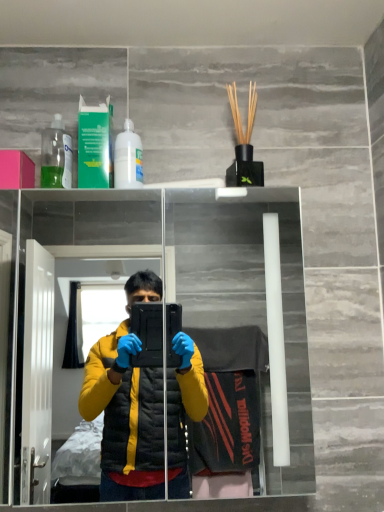
This screenshot has width=384, height=512. Describe the element at coordinates (95, 145) in the screenshot. I see `green plastic mouthwash at upper left` at that location.

Image resolution: width=384 pixels, height=512 pixels. Describe the element at coordinates (202, 98) in the screenshot. I see `transparent glass mirror at upper center` at that location.

The width and height of the screenshot is (384, 512). Identify the location of transparent plastic bottle at upper left, the second bottle viewed from the right. (56, 156).

Would you say pink matte box at upper left is part of transparent glass mirror at upper center's contents?

No, pink matte box at upper left is not inside transparent glass mirror at upper center.

From the image's perspective, is transparent glass mirror at upper center on pink matte box at upper left?

No.

Locate an element on the screen. This screenshot has height=512, width=384. mirror that is under the pink matte box at upper left (from a real-world perspective) is located at coordinates (202, 98).

Measure the distance between transparent glass mirror at upper center and pink matte box at upper left.

A distance of 5.73 feet exists between transparent glass mirror at upper center and pink matte box at upper left.

Does transparent plastic bottle at upper left, placed as the first bottle when sorted from left to right, have a lesser height compared to transparent glass mirror at upper center?

Correct, transparent plastic bottle at upper left, placed as the first bottle when sorted from left to right, is not as tall as transparent glass mirror at upper center.

Is transparent plastic bottle at upper left, the second bottle viewed from the right, with transparent glass mirror at upper center?

They are not placed beside each other.

Is transparent plastic bottle at upper left, placed as the first bottle when sorted from left to right, oriented towards transparent glass mirror at upper center?

No.

Which of these two, transparent plastic bottle at upper left, placed as the first bottle when sorted from left to right, or transparent glass mirror at upper center, is bigger?

With larger size is transparent glass mirror at upper center.

Considering the sizes of objects white glossy bottle at upper center, the second bottle positioned from the left, and green plastic mouthwash at upper left in the image provided, who is thinner, white glossy bottle at upper center, the second bottle positioned from the left, or green plastic mouthwash at upper left?

With smaller width is green plastic mouthwash at upper left.

From a real-world perspective, which is physically below, white glossy bottle at upper center, the second bottle positioned from the left, or green plastic mouthwash at upper left?

white glossy bottle at upper center, the second bottle positioned from the left, from a real-world perspective.

Is green plastic mouthwash at upper left at the back of white glossy bottle at upper center, the second bottle positioned from the left?

white glossy bottle at upper center, the second bottle positioned from the left, does not have its back to green plastic mouthwash at upper left.

From the image's perspective, who appears lower, transparent glass mirror at upper center or green plastic mouthwash at upper left?

transparent glass mirror at upper center.

Is transparent glass mirror at upper center not close to green plastic mouthwash at upper left?

Indeed, transparent glass mirror at upper center is not near green plastic mouthwash at upper left.

The image size is (384, 512). What are the coordinates of `mouthwash above the transparent glass mirror at upper center (from a real-world perspective)` in the screenshot? It's located at (95, 145).

In the scene shown: From a real-world perspective, is transparent glass mirror at upper center physically located above or below green plastic mouthwash at upper left?

Answer: transparent glass mirror at upper center is situated lower than green plastic mouthwash at upper left in the real world.

From a real-world perspective, who is located lower, transparent glass mirror at upper center or transparent plastic bottle at upper left, the second bottle viewed from the right?

transparent glass mirror at upper center, from a real-world perspective.

Which point is more distant from viewer, (290, 487) or (57, 178)?

The point (290, 487) is farther from the camera.

Does transparent glass mirror at upper center have a lesser width compared to transparent plastic bottle at upper left, placed as the first bottle when sorted from left to right?

Incorrect, the width of transparent glass mirror at upper center is not less than that of transparent plastic bottle at upper left, placed as the first bottle when sorted from left to right.

Is transparent glass mirror at upper center further to the viewer compared to transparent plastic bottle at upper left, the second bottle viewed from the right?

No, the depth of transparent glass mirror at upper center is less than that of transparent plastic bottle at upper left, the second bottle viewed from the right.

Consider the image. Is white glossy bottle at upper center, the second bottle positioned from the left, not inside transparent plastic bottle at upper left, the second bottle viewed from the right?

Absolutely, white glossy bottle at upper center, the second bottle positioned from the left, is external to transparent plastic bottle at upper left, the second bottle viewed from the right.

From a real-world perspective, is white glossy bottle at upper center, the first bottle viewed from the right, physically located above or below transparent plastic bottle at upper left, the second bottle viewed from the right?

From a real-world perspective, white glossy bottle at upper center, the first bottle viewed from the right, is physically below transparent plastic bottle at upper left, the second bottle viewed from the right.

From the image's perspective, which one is positioned higher, white glossy bottle at upper center, the second bottle positioned from the left, or transparent plastic bottle at upper left, the second bottle viewed from the right?

transparent plastic bottle at upper left, the second bottle viewed from the right, appears higher in the image.

Is point (139, 170) closer or farther from the camera than point (71, 178)?

Point (139, 170) appears to be closer to the viewer than point (71, 178).

Is white glossy bottle at upper center, the first bottle viewed from the right, taller than transparent glass mirror at upper center?

In fact, white glossy bottle at upper center, the first bottle viewed from the right, may be shorter than transparent glass mirror at upper center.

From the image's perspective, would you say white glossy bottle at upper center, the first bottle viewed from the right, is positioned over transparent glass mirror at upper center?

Correct, white glossy bottle at upper center, the first bottle viewed from the right, appears higher than transparent glass mirror at upper center in the image.

Does point (139, 163) come behind point (183, 294)?

No, (139, 163) is in front of (183, 294).

Is white glossy bottle at upper center, the first bottle viewed from the right, turned away from transparent glass mirror at upper center?

white glossy bottle at upper center, the first bottle viewed from the right, is not turned away from transparent glass mirror at upper center.

I want to click on mirror below the pink matte box at upper left (from a real-world perspective), so click(202, 98).

From a real-world perspective, starting from the transparent glass mirror at upper center, which bottle is the 2nd one vertically above it? Please provide its 2D coordinates.

[(56, 156)]

When comparing their distances from transparent plastic bottle at upper left, placed as the first bottle when sorted from left to right, does white glossy bottle at upper center, the first bottle viewed from the right, or green plastic mouthwash at upper left seem further?

Among the two, white glossy bottle at upper center, the first bottle viewed from the right, is located further to transparent plastic bottle at upper left, placed as the first bottle when sorted from left to right.

Based on the photo, estimate the real-world distances between objects in this image. Which object is further from transparent glass mirror at upper center, pink matte box at upper left or green plastic mouthwash at upper left?

pink matte box at upper left is positioned further to the anchor transparent glass mirror at upper center.

From the image, which object appears to be nearer to transparent glass mirror at upper center, white glossy bottle at upper center, the second bottle positioned from the left, or green plastic mouthwash at upper left?

The object closer to transparent glass mirror at upper center is green plastic mouthwash at upper left.

Based on their spatial positions, is green plastic mouthwash at upper left or white glossy bottle at upper center, the second bottle positioned from the left, further from pink matte box at upper left?

Based on the image, white glossy bottle at upper center, the second bottle positioned from the left, appears to be further to pink matte box at upper left.

Based on their spatial positions, is green plastic mouthwash at upper left or transparent plastic bottle at upper left, the second bottle viewed from the right, closer to white glossy bottle at upper center, the second bottle positioned from the left?

green plastic mouthwash at upper left is positioned closer to the anchor white glossy bottle at upper center, the second bottle positioned from the left.

When comparing their distances from transparent plastic bottle at upper left, placed as the first bottle when sorted from left to right, does green plastic mouthwash at upper left or transparent glass mirror at upper center seem further?

The object further to transparent plastic bottle at upper left, placed as the first bottle when sorted from left to right, is transparent glass mirror at upper center.

From the image, which object appears to be nearer to green plastic mouthwash at upper left, white glossy bottle at upper center, the first bottle viewed from the right, or transparent glass mirror at upper center?

white glossy bottle at upper center, the first bottle viewed from the right, is closer to green plastic mouthwash at upper left.

Based on their spatial positions, is white glossy bottle at upper center, the first bottle viewed from the right, or transparent glass mirror at upper center closer to pink matte box at upper left?

white glossy bottle at upper center, the first bottle viewed from the right, is positioned closer to the anchor pink matte box at upper left.

The height and width of the screenshot is (512, 384). Identify the location of box that lies between green plastic mouthwash at upper left and transparent glass mirror at upper center from top to bottom. (16, 170).

Where is `bottle between pink matte box at upper left and white glossy bottle at upper center, the first bottle viewed from the right`? The width and height of the screenshot is (384, 512). bottle between pink matte box at upper left and white glossy bottle at upper center, the first bottle viewed from the right is located at coordinates (56, 156).

The image size is (384, 512). In order to click on bottle between pink matte box at upper left and green plastic mouthwash at upper left from left to right in this screenshot , I will do `click(56, 156)`.

You are a GUI agent. You are given a task and a screenshot of the screen. Output one action in this format:
    pyautogui.click(x=<x>, y=<y>)
    Task: Click on the box between transparent plastic bottle at upper left, the second bottle viewed from the right, and transparent glass mirror at upper center, in the vertical direction
    The width and height of the screenshot is (384, 512).
    Given the screenshot: What is the action you would take?
    pyautogui.click(x=16, y=170)